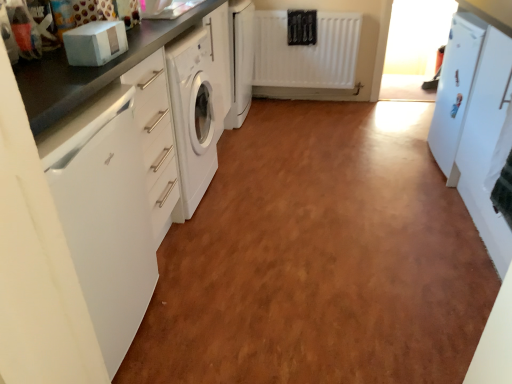
Locate an element on the screen. vacant area that lies between white glossy refrigerator at right and white matte refrigerator at right, placed as the first cabinetry when sorted from right to left is located at coordinates (448, 215).